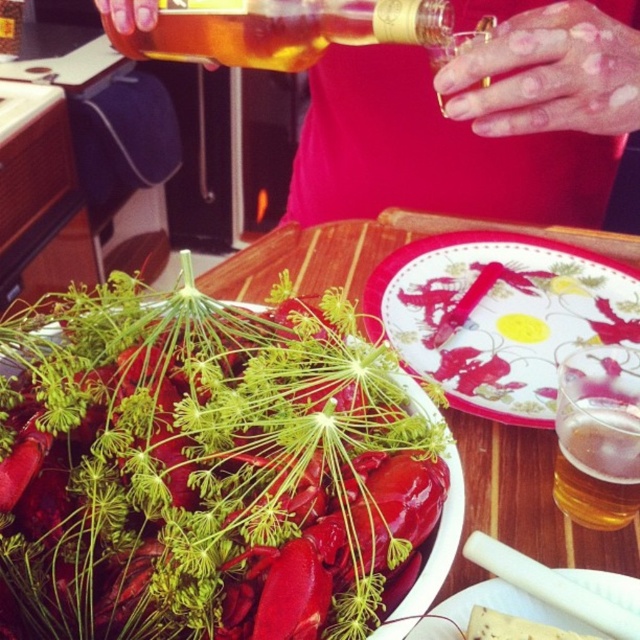
You are a food photographer setting up a shot of the shiny red lobster at center and the translucent glass beer at upper right. You need to ensure the lobster is the focal point. Which object should you position closer to the camera to emphasize its size?

The shiny red lobster at center is wider than the translucent glass beer at upper right, so positioning it closer to the camera will make it appear larger and emphasize it as the focal point.

You are a photographer setting up a shot of the table. You want to focus on the point that is closer to the camera. Which point should you choose between point [412,156] and point [472,252]?

Answer: Point [472,252] is closer to the camera than point [412,156], so you should focus on point [472,252].

You are a guest at a dinner party and want to grab a drink. You see the smooth plastic bottle at upper center and the white glossy plate at center. Which one is taller?

The smooth plastic bottle at upper center is much taller than the white glossy plate at center.